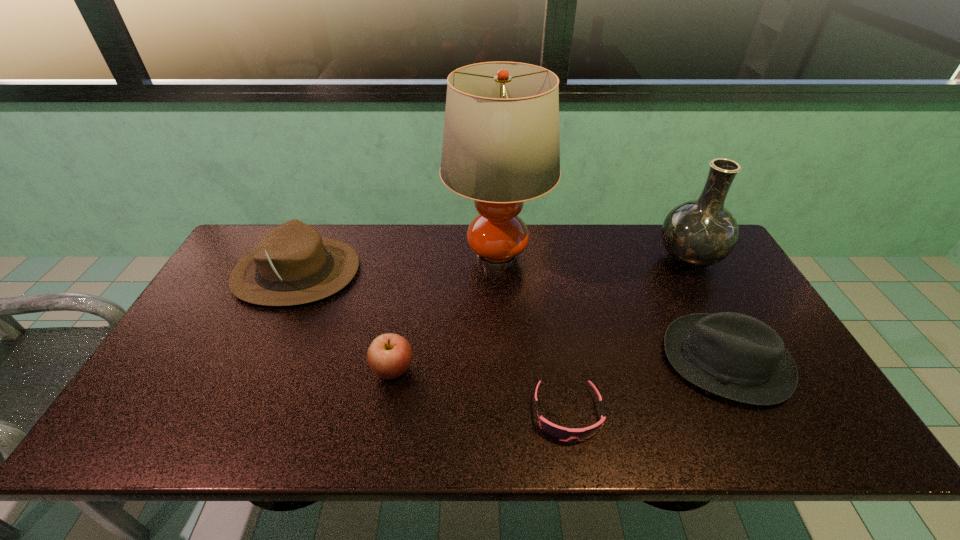
This screenshot has width=960, height=540. Find the location of `the tallest object`. the tallest object is located at coordinates (501, 147).

The width and height of the screenshot is (960, 540). Identify the location of the fifth shortest object. (699, 233).

Where is `the third tallest object`? The image size is (960, 540). the third tallest object is located at coordinates (292, 265).

This screenshot has height=540, width=960. Find the location of `the left fedora`. the left fedora is located at coordinates (292, 265).

Find the location of `the right fedora`. the right fedora is located at coordinates (735, 356).

You are a GUI agent. You are given a task and a screenshot of the screen. Output one action in this format:
    pyautogui.click(x=<x>, y=<y>)
    Task: Click on the nearer fedora
    
    Given the screenshot: What is the action you would take?
    pyautogui.click(x=735, y=356)

Where is `apple`? apple is located at coordinates (389, 355).

You are a GUI agent. You are given a task and a screenshot of the screen. Output one action in this format:
    pyautogui.click(x=<x>, y=<y>)
    Task: Click on the shortest object
    This screenshot has width=960, height=540.
    Given the screenshot: What is the action you would take?
    pyautogui.click(x=561, y=433)

This screenshot has width=960, height=540. I want to click on vacant space located 0.310m on the left of the tallest object, so click(350, 258).

Identify the location of free region located 0.230m on the left of the fifth shortest object. (585, 259).